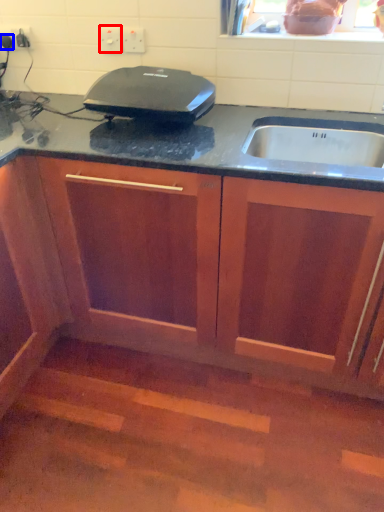
Question: Which of the following is the farthest to the observer, electric outlet (highlighted by a red box) or kitchen appliance (highlighted by a blue box)?

Choices:
 (A) electric outlet
 (B) kitchen appliance

Answer: (B)